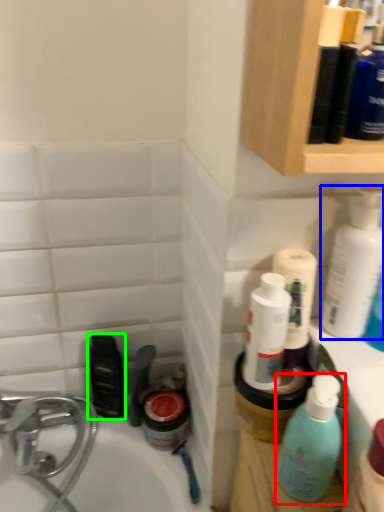
Question: Estimate the real-world distances between objects in this image. Which object is farther from bottle (highlighted by a red box), cleaning product (highlighted by a blue box) or mouthwash (highlighted by a green box)?

Choices:
 (A) cleaning product
 (B) mouthwash

Answer: (B)